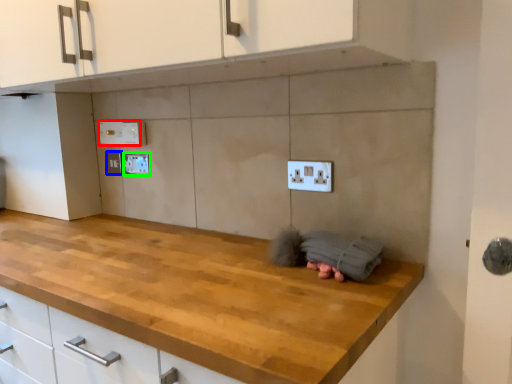
Question: Estimate the real-world distances between objects in this image. Which object is closer to electric outlet (highlighted by a red box), electric outlet (highlighted by a blue box) or electric outlet (highlighted by a green box)?

Choices:
 (A) electric outlet
 (B) electric outlet

Answer: (B)